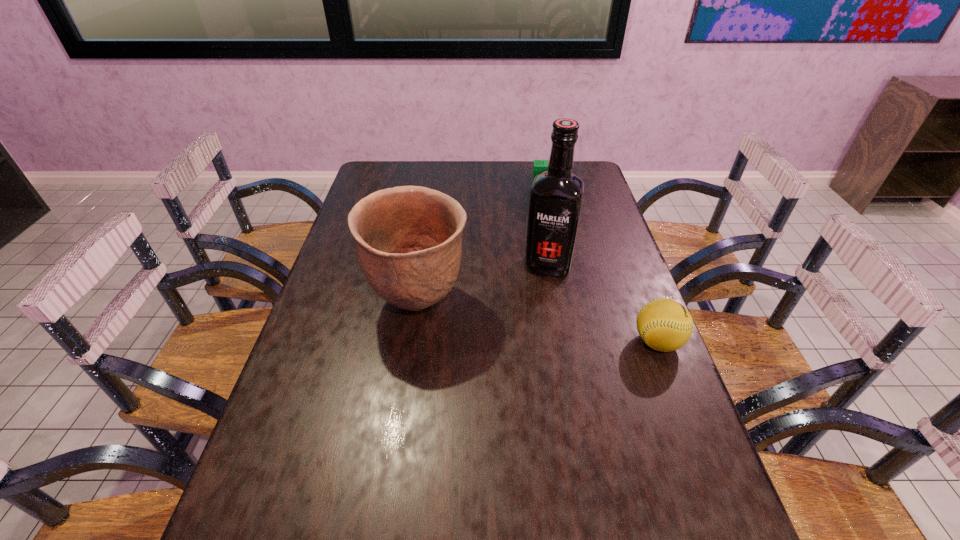
What are the coordinates of `vacant space in between the farthest object and the pottery` in the screenshot? It's located at (484, 248).

Where is `the third closest object to the alarm clock`? the third closest object to the alarm clock is located at coordinates (665, 325).

Locate which object ranks third in proximity to the softball. Please provide its 2D coordinates. Your answer should be formatted as a tuple, i.e. [(x, y)], where the tuple contains the x and y coordinates of a point satisfying the conditions above.

[(539, 166)]

Identify the location of vacant space that satisfies the following two spatial constraints: 1. on the front side of the alarm clock; 2. on the logo side of the softball. (581, 342).

What are the coordinates of `vacant point that satisfies the following two spatial constraints: 1. on the back side of the second tallest object; 2. on the left side of the tallest object` in the screenshot? It's located at (423, 265).